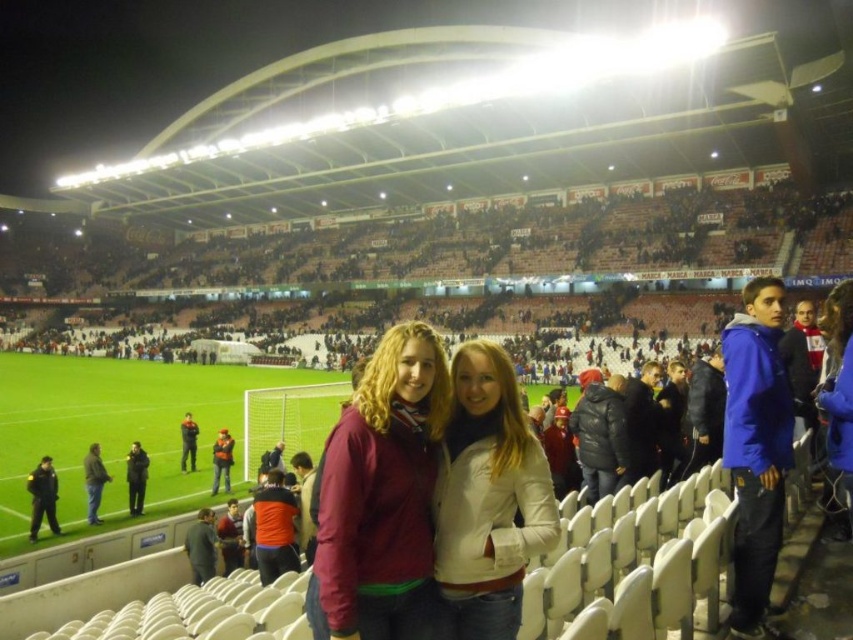
Is the position of dark blue uniform at center more distant than that of dark blue jacket at center?

No.

Who is higher up, dark blue uniform at center or dark blue jacket at center?

dark blue jacket at center is higher up.

Is point (50, 524) farther from camera compared to point (125, 474)?

That is False.

Find the location of a particular element. The height and width of the screenshot is (640, 853). dark blue uniform at center is located at coordinates (42, 497).

Describe the element at coordinates (488, 499) in the screenshot. The height and width of the screenshot is (640, 853). I see `white matte jacket at center` at that location.

Is white matte jacket at center shorter than orange fabric jacket at lower center?

In fact, white matte jacket at center may be taller than orange fabric jacket at lower center.

This screenshot has width=853, height=640. I want to click on white matte jacket at center, so click(488, 499).

I want to click on white matte jacket at center, so click(488, 499).

Is point (451, 580) less distant than point (96, 445)?

Yes, point (451, 580) is closer to viewer.

Locate an element on the screen. Image resolution: width=853 pixels, height=640 pixels. white matte jacket at center is located at coordinates (488, 499).

Between point (503, 376) and point (88, 483), which one is positioned behind?

The point (88, 483) is behind.

Where is `white matte jacket at center`? white matte jacket at center is located at coordinates (488, 499).